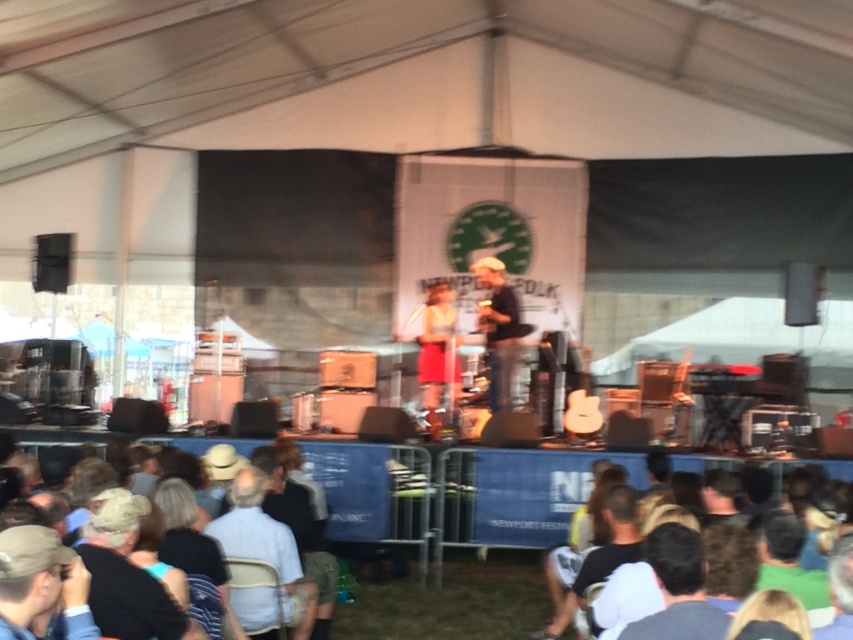
Based on the photo, you are a photographer at the concert and want to capture both the matte brown hat at center and the yellow fabric shirt at center in your shot. Which object should you adjust your camera focus to first to ensure both are in frame?

Since the matte brown hat at center is to the right of the yellow fabric shirt at center, you should focus on the yellow fabric shirt at center first to ensure the entire area between them is captured.

You are a stagehand who needs to place a 10 feet long ladder between the light blue fabric at lower center and the matte brown hat at center. Is there enough space between them to place the ladder horizontally?

The distance between the light blue fabric at lower center and the matte brown hat at center is 17.14 feet, which is greater than the ladder length of 10 feet. Therefore, there is sufficient space to place the ladder horizontally between them.

You are standing at the entrance of the concert venue and see the light blue fabric at lower center. Where would you find it in relation to the stage?

The light blue fabric at lower center is located at the stage area, as its coordinates are close to the stage setup described in the scene.